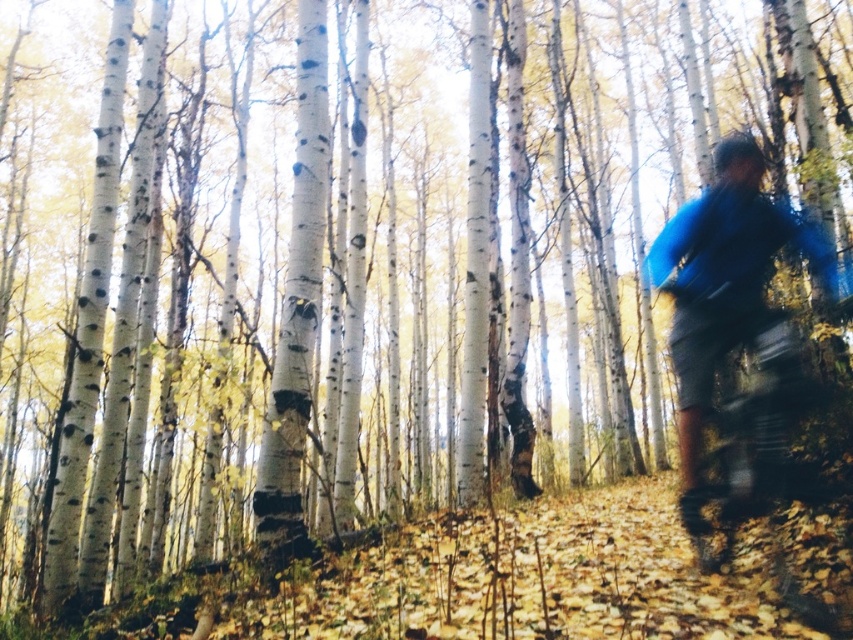
Is point (740, 150) more distant than point (817, 378)?

Yes, point (740, 150) is farther from viewer.

Who is positioned more to the right, blue fabric jacket at right or metallic silver mountain bike at right?

metallic silver mountain bike at right is more to the right.

Describe the element at coordinates (733, 314) in the screenshot. I see `blue fabric jacket at right` at that location.

The image size is (853, 640). I want to click on blue fabric jacket at right, so click(x=733, y=314).